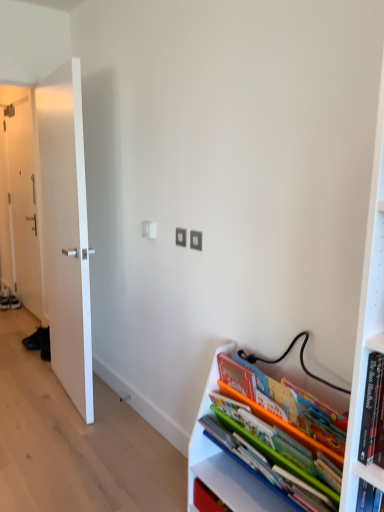
What do you see at coordinates (21, 200) in the screenshot?
I see `white matte door at left, the 2th door when ordered from front to back` at bounding box center [21, 200].

Identify the location of matte plastic books at lower right. Image resolution: width=384 pixels, height=512 pixels. [247, 403].

This screenshot has width=384, height=512. In order to click on book that appears in front of the white matte door at left, the 1th door viewed from the back in this screenshot , I will do `click(247, 403)`.

How many degrees apart are the facing directions of white matte door at left, the 1th door viewed from the back, and matte plastic books at lower right?

They differ by 0.784 degrees in their facing directions.

Between white matte door at left, the 2th door when ordered from front to back, and matte plastic books at lower right, which one has less height?

Standing shorter between the two is matte plastic books at lower right.

Can matte plastic books at lower right be found inside white matte door at left, the 1th door viewed from the back?

That's incorrect, matte plastic books at lower right is not inside white matte door at left, the 1th door viewed from the back.

Are white smooth door at left, the 1th door when ordered from front to back, and matte plastic books at lower right far apart?

white smooth door at left, the 1th door when ordered from front to back, is far away from matte plastic books at lower right.

Considering the relative positions of white smooth door at left, which is the second door in back-to-front order, and matte plastic books at lower right in the image provided, is white smooth door at left, which is the second door in back-to-front order, to the right of matte plastic books at lower right from the viewer's perspective?

No.

Is white smooth door at left, the second door positioned from the left, thinner than matte plastic books at lower right?

Correct, the width of white smooth door at left, the second door positioned from the left, is less than that of matte plastic books at lower right.

Is white smooth door at left, the second door positioned from the left, inside or outside of matte plastic books at lower right?

white smooth door at left, the second door positioned from the left, is located beyond the bounds of matte plastic books at lower right.

Does matte plastic books at lower right touch white smooth door at left, marked as the 1th door in a right-to-left arrangement?

matte plastic books at lower right and white smooth door at left, marked as the 1th door in a right-to-left arrangement, are not in contact.

From the image's perspective, relative to white smooth door at left, which is the second door in back-to-front order, is matte plastic books at lower right above or below?

matte plastic books at lower right is below white smooth door at left, which is the second door in back-to-front order.

Is white smooth door at left, which is the second door in back-to-front order, surrounded by matte plastic books at lower right?

No, white smooth door at left, which is the second door in back-to-front order, is not inside matte plastic books at lower right.

Can we say white smooth door at left, the second door positioned from the left, lies outside white matte door at left, the 2th door when ordered from front to back?

Absolutely, white smooth door at left, the second door positioned from the left, is external to white matte door at left, the 2th door when ordered from front to back.

Is white smooth door at left, marked as the 1th door in a right-to-left arrangement, not near white matte door at left, placed as the 2th door when sorted from right to left?

Yes, white smooth door at left, marked as the 1th door in a right-to-left arrangement, is far from white matte door at left, placed as the 2th door when sorted from right to left.

Looking at this image, from a real-world perspective, is white smooth door at left, the 1th door when ordered from front to back, below white matte door at left, placed as the 2th door when sorted from right to left?

Yes, from a real-world perspective, white smooth door at left, the 1th door when ordered from front to back, is beneath white matte door at left, placed as the 2th door when sorted from right to left.

What are the coordinates of `door on the left of white smooth door at left, which is the second door in back-to-front order` in the screenshot? It's located at (21, 200).

Relative to white matte door at left, the 2th door when ordered from front to back, is matte plastic books at lower right in front or behind?

Visually, matte plastic books at lower right is located in front of white matte door at left, the 2th door when ordered from front to back.

From a real-world perspective, is matte plastic books at lower right positioned under white matte door at left, the 1th door viewed from the back, based on gravity?

Correct, in the physical world, matte plastic books at lower right is lower than white matte door at left, the 1th door viewed from the back.

Can we say matte plastic books at lower right lies outside white matte door at left, the 2th door when ordered from front to back?

Yes, matte plastic books at lower right is located beyond the bounds of white matte door at left, the 2th door when ordered from front to back.

Does white matte door at left, placed as the 2th door when sorted from right to left, have a greater width compared to white smooth door at left, the 1th door when ordered from front to back?

No.

Is white matte door at left, the 2th door when ordered from front to back, in front of or behind white smooth door at left, marked as the 1th door in a right-to-left arrangement, in the image?

In the image, white matte door at left, the 2th door when ordered from front to back, appears behind white smooth door at left, marked as the 1th door in a right-to-left arrangement.

Locate an element on the screen. door below the white matte door at left, placed as the 2th door when sorted from right to left (from a real-world perspective) is located at coordinates point(66,232).

Is white matte door at left, the 1th door viewed from the back, positioned with its back to white smooth door at left, the second door positioned from the left?

No, white smooth door at left, the second door positioned from the left, is not at the back of white matte door at left, the 1th door viewed from the back.

In order to click on the 2nd door behind the matte plastic books at lower right in this screenshot , I will do `click(21, 200)`.

Find the location of `door that is the 1st object located above the matte plastic books at lower right (from the image's perspective)`. door that is the 1st object located above the matte plastic books at lower right (from the image's perspective) is located at coordinates (66, 232).

From the image, which object appears to be nearer to white matte door at left, the 2th door when ordered from front to back, white smooth door at left, the 1th door when ordered from front to back, or matte plastic books at lower right?

white smooth door at left, the 1th door when ordered from front to back.

From the image, which object appears to be nearer to matte plastic books at lower right, white matte door at left, the 1th door viewed from the back, or white smooth door at left, the second door positioned from the left?

The object closer to matte plastic books at lower right is white smooth door at left, the second door positioned from the left.

When comparing their distances from white matte door at left, acting as the first door starting from the left, does matte plastic books at lower right or white smooth door at left, which is the second door in back-to-front order, seem further?

The object further to white matte door at left, acting as the first door starting from the left, is matte plastic books at lower right.

Which object lies further to the anchor point white smooth door at left, the 1th door when ordered from front to back, white matte door at left, the 1th door viewed from the back, or matte plastic books at lower right?

white matte door at left, the 1th door viewed from the back, lies further to white smooth door at left, the 1th door when ordered from front to back, than the other object.

Looking at the image, which one is located further to matte plastic books at lower right, white smooth door at left, the second door positioned from the left, or white matte door at left, acting as the first door starting from the left?

white matte door at left, acting as the first door starting from the left.

Based on their spatial positions, is matte plastic books at lower right or white matte door at left, the 2th door when ordered from front to back, closer to white smooth door at left, marked as the 1th door in a right-to-left arrangement?

matte plastic books at lower right is positioned closer to the anchor white smooth door at left, marked as the 1th door in a right-to-left arrangement.

Where is `door located between matte plastic books at lower right and white matte door at left, placed as the 2th door when sorted from right to left, in the depth direction`? door located between matte plastic books at lower right and white matte door at left, placed as the 2th door when sorted from right to left, in the depth direction is located at coordinates (66, 232).